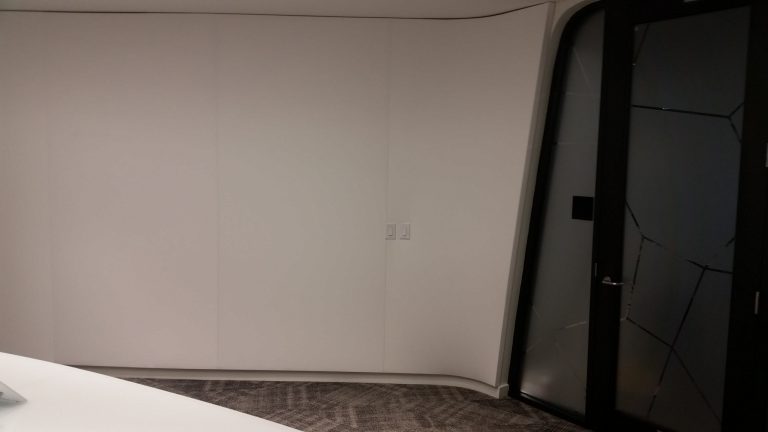
The height and width of the screenshot is (432, 768). I want to click on light swtich, so click(401, 230), click(385, 230).